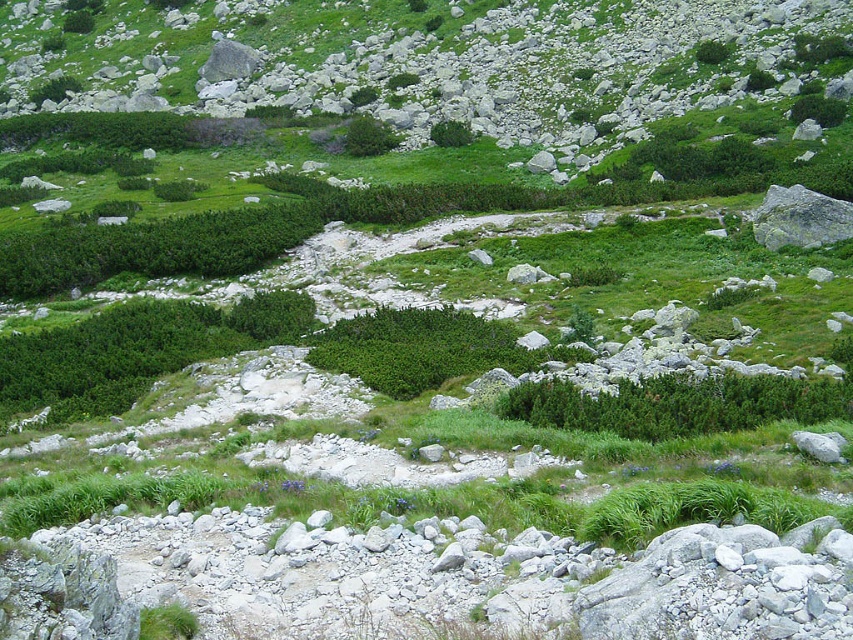
The image size is (853, 640). What are the coordinates of `green matte shrub at center` in the screenshot? It's located at (677, 404).

Is point (595, 412) positioned in front of point (439, 124)?

Yes, it is in front of point (439, 124).

Identify the location of green matte shrub at center. Image resolution: width=853 pixels, height=640 pixels. (677, 404).

Based on the photo, is green matte shrub at center positioned at the back of green leafy bush at center?

No.

Can you confirm if green matte shrub at center is shorter than green leafy bush at center?

Indeed, green matte shrub at center has a lesser height compared to green leafy bush at center.

Which is behind, point (735, 428) or point (352, 145)?

The point (352, 145) is more distant.

You are a GUI agent. You are given a task and a screenshot of the screen. Output one action in this format:
    pyautogui.click(x=<x>, y=<y>)
    Task: Click on the green matte shrub at center
    Image resolution: width=853 pixels, height=640 pixels.
    Given the screenshot: What is the action you would take?
    pyautogui.click(x=677, y=404)

Is green leafy bush at center to the left of green leafy shrub at center from the viewer's perspective?

Correct, you'll find green leafy bush at center to the left of green leafy shrub at center.

Looking at this image, who is higher up, green leafy bush at center or green leafy shrub at center?

green leafy bush at center is above.

What do you see at coordinates (368, 136) in the screenshot? The width and height of the screenshot is (853, 640). I see `green leafy bush at center` at bounding box center [368, 136].

Image resolution: width=853 pixels, height=640 pixels. In order to click on green leafy bush at center in this screenshot , I will do `click(368, 136)`.